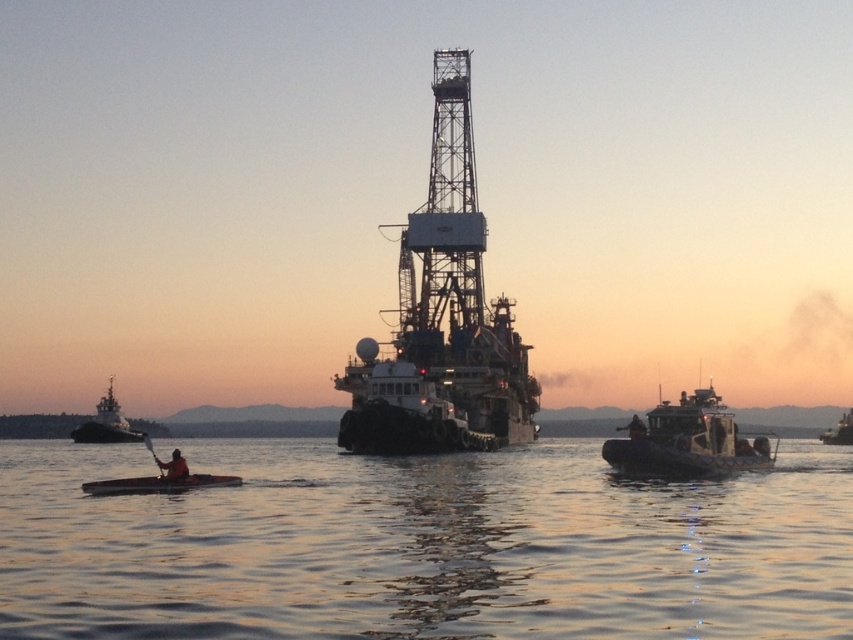
Question: Which point appears farthest from the camera in this image?

Choices:
 (A) (102, 484)
 (B) (630, 424)

Answer: (B)

Question: Among these objects, which one is nearest to the camera?

Choices:
 (A) brushed metal tugboat at left
 (B) green rubber boat at right
 (C) clear water at lower center

Answer: (C)

Question: Is clear water at lower center positioned before dark blue fabric jacket at right?

Choices:
 (A) no
 (B) yes

Answer: (B)

Question: Which of the following is the farthest from the observer?

Choices:
 (A) [x=703, y=428]
 (B) [x=143, y=436]
 (C) [x=85, y=428]

Answer: (B)

Question: Can you confirm if metallic industrial ship at center is positioned below dark blue fabric jacket at right?

Choices:
 (A) no
 (B) yes

Answer: (A)

Question: Can you confirm if brushed metal tugboat at left is positioned to the left of wooden paddle at lower left?

Choices:
 (A) yes
 (B) no

Answer: (A)